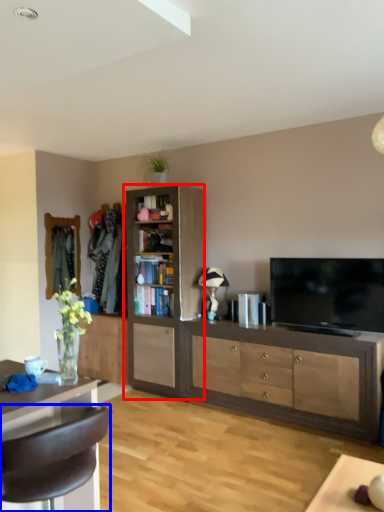
Question: Among these objects, which one is nearest to the camera, cabinetry (highlighted by a red box) or chair (highlighted by a blue box)?

Choices:
 (A) cabinetry
 (B) chair

Answer: (B)